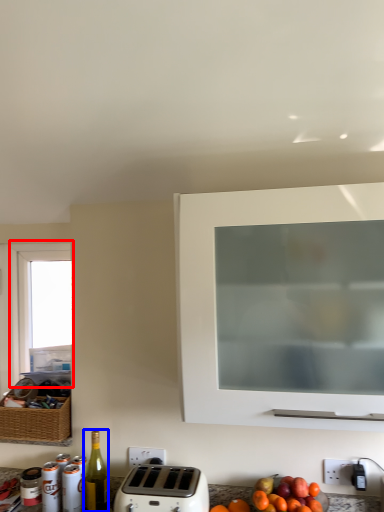
Question: Which object is closer to the camera taking this photo, window (highlighted by a red box) or bottle (highlighted by a blue box)?

Choices:
 (A) window
 (B) bottle

Answer: (B)